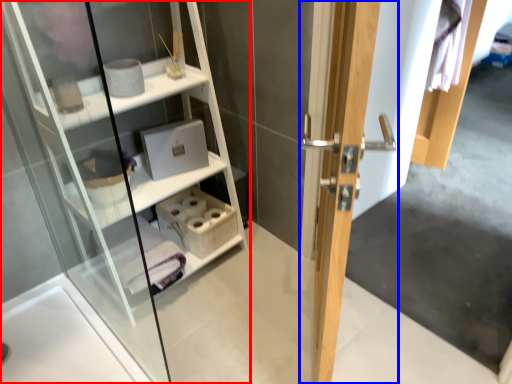
Question: Among these objects, which one is farthest to the camera, shelf (highlighted by a red box) or door (highlighted by a blue box)?

Choices:
 (A) shelf
 (B) door

Answer: (A)